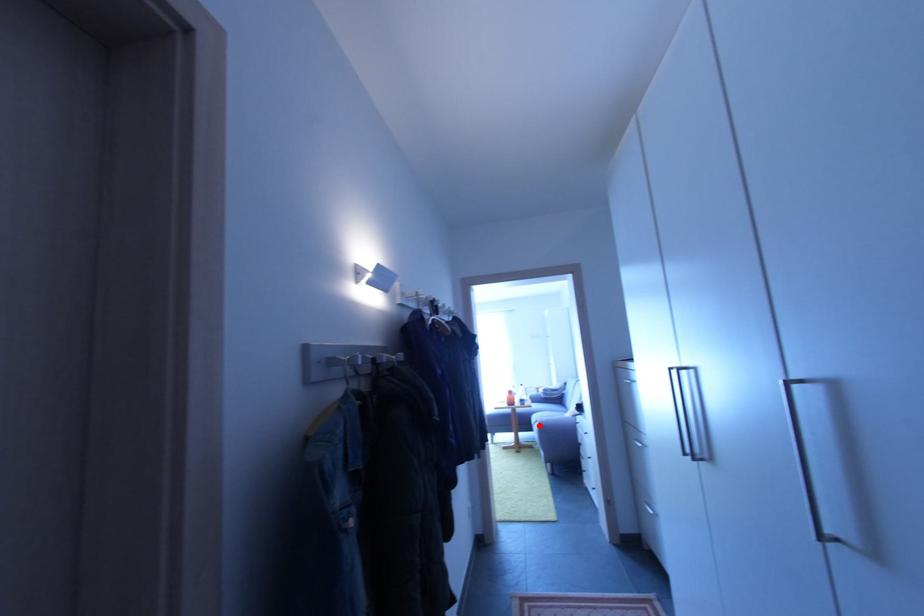
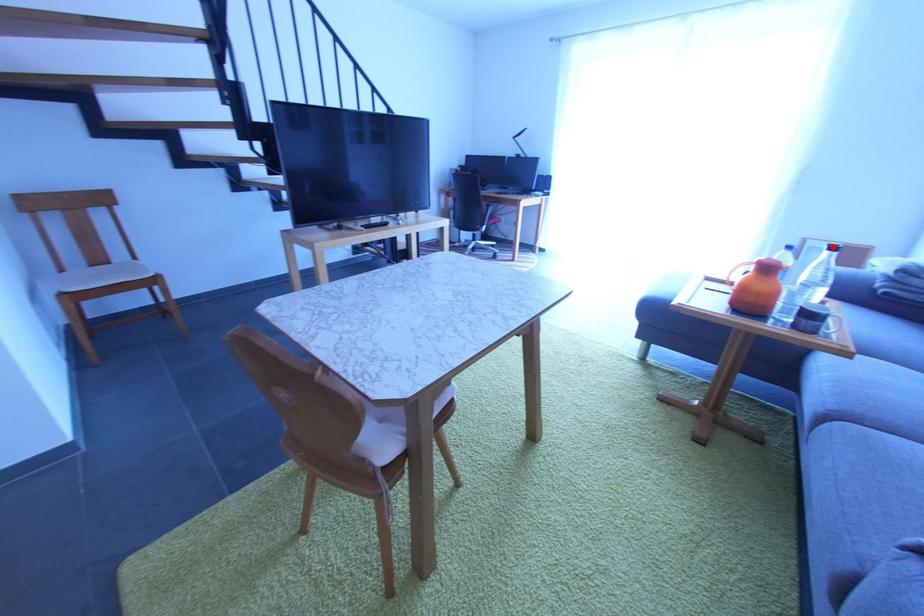
I am providing you with two images of the same scene from different viewpoints. A red point is marked on the first image and another point is marked on the second image. Are the points marked in image1 and image2 representing the same 3D position?

No